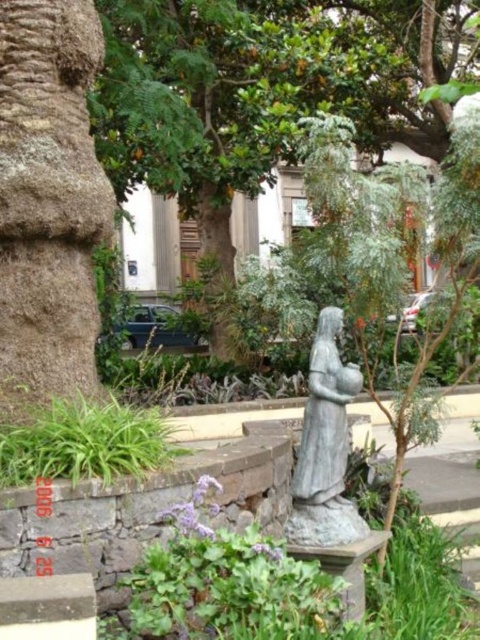
Question: Is green grass at lower left in front of gray stone statue at center?

Choices:
 (A) yes
 (B) no

Answer: (A)

Question: Is green grass at lower left further to the viewer compared to gray stone statue at center?

Choices:
 (A) no
 (B) yes

Answer: (A)

Question: From the image, what is the correct spatial relationship of green grass at lower left in relation to gray stone statue at center?

Choices:
 (A) above
 (B) below

Answer: (B)

Question: Which point is closer to the camera taking this photo?

Choices:
 (A) (326, 490)
 (B) (61, 465)

Answer: (B)